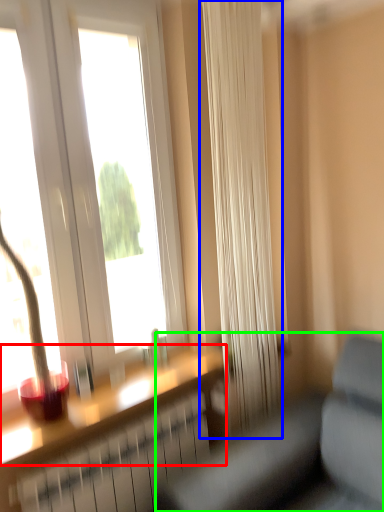
Question: Which object is the farthest from window sill (highlighted by a red box)? Choose among these: curtain (highlighted by a blue box) or studio couch (highlighted by a green box).

Choices:
 (A) curtain
 (B) studio couch

Answer: (A)